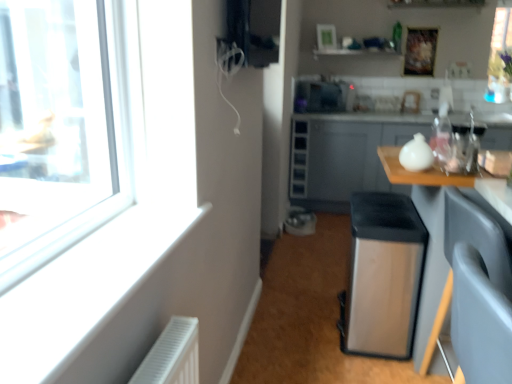
Question: Would you say matte gray cabinet at right is outside satin silver water heater at center?

Choices:
 (A) yes
 (B) no

Answer: (A)

Question: Could you tell me if matte gray cabinet at right is facing satin silver water heater at center?

Choices:
 (A) yes
 (B) no

Answer: (A)

Question: Could satin silver water heater at center be considered to be inside matte gray cabinet at right?

Choices:
 (A) yes
 (B) no

Answer: (B)

Question: From the image's perspective, is matte gray cabinet at right on top of satin silver water heater at center?

Choices:
 (A) no
 (B) yes

Answer: (B)

Question: Does matte gray cabinet at right come behind satin silver water heater at center?

Choices:
 (A) yes
 (B) no

Answer: (A)

Question: Does matte gray cabinet at right have a greater width compared to satin silver water heater at center?

Choices:
 (A) yes
 (B) no

Answer: (A)

Question: From a real-world perspective, is satin black microwave at upper center located higher than transparent plastic bottle at upper right?

Choices:
 (A) yes
 (B) no

Answer: (B)

Question: Does satin black microwave at upper center have a greater height compared to transparent plastic bottle at upper right?

Choices:
 (A) yes
 (B) no

Answer: (B)

Question: Considering the relative sizes of satin black microwave at upper center and transparent plastic bottle at upper right in the image provided, is satin black microwave at upper center thinner than transparent plastic bottle at upper right?

Choices:
 (A) yes
 (B) no

Answer: (B)

Question: Is satin black microwave at upper center aimed at transparent plastic bottle at upper right?

Choices:
 (A) no
 (B) yes

Answer: (B)

Question: Is satin black microwave at upper center smaller than transparent plastic bottle at upper right?

Choices:
 (A) no
 (B) yes

Answer: (A)

Question: Is satin black microwave at upper center positioned before transparent plastic bottle at upper right?

Choices:
 (A) yes
 (B) no

Answer: (B)

Question: Considering the relative sizes of wooden table at right and satin silver trash can at center in the image provided, is wooden table at right smaller than satin silver trash can at center?

Choices:
 (A) yes
 (B) no

Answer: (B)